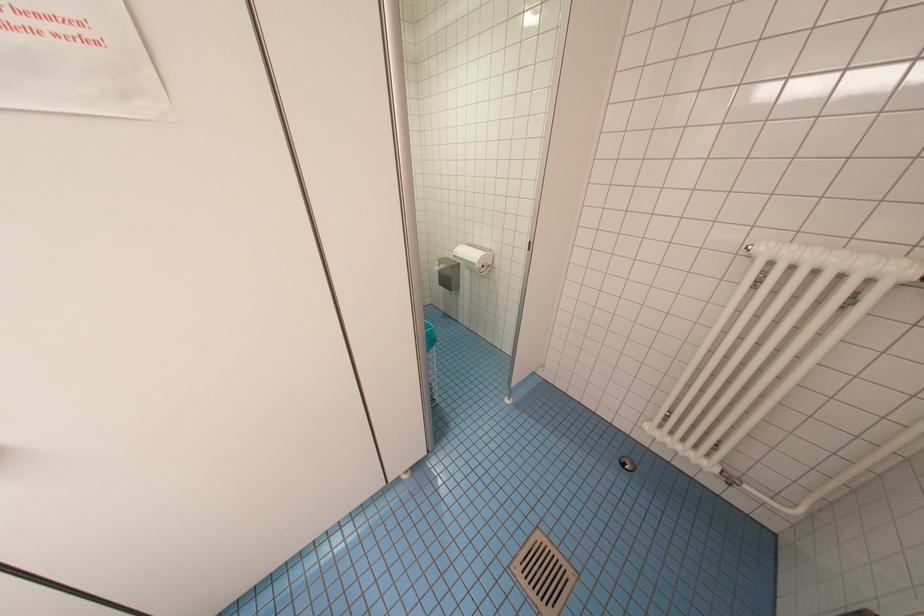
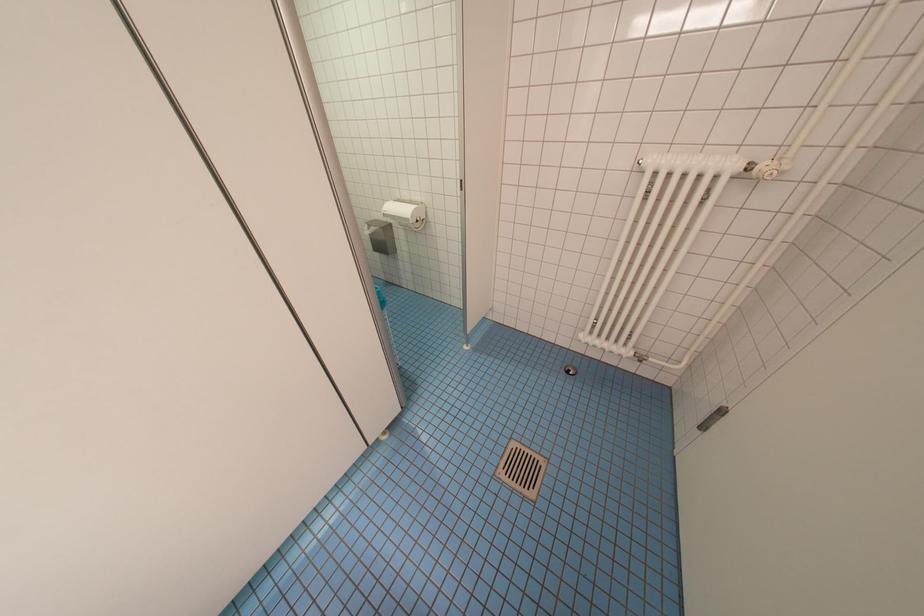
Question: How did the camera likely rotate?

Choices:
 (A) Left
 (B) Right
 (C) Up
 (D) Down

Answer: (B)